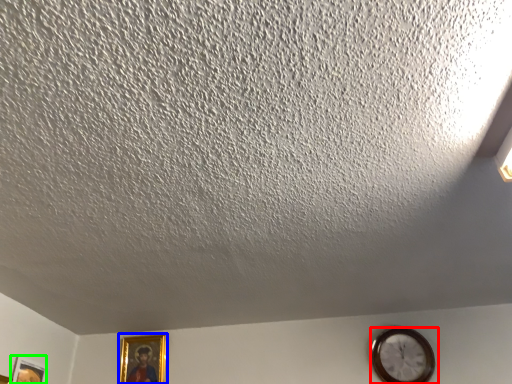
Question: Which is nearer to the wall clock (highlighted by a red box)? picture frame (highlighted by a blue box) or picture frame (highlighted by a green box).

Choices:
 (A) picture frame
 (B) picture frame

Answer: (A)